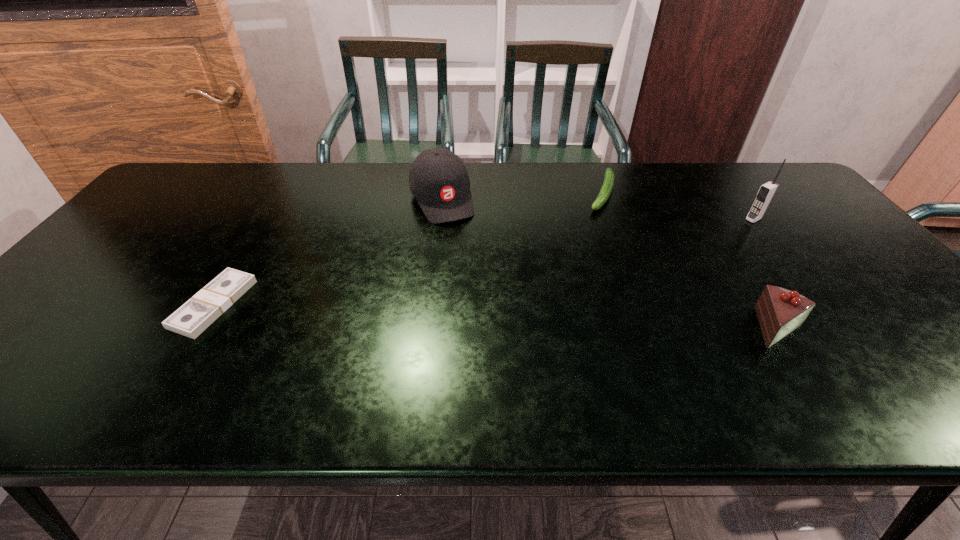
Find the location of a particular element. The height and width of the screenshot is (540, 960). vacant space positioned on the front-facing side of the rightmost object is located at coordinates (663, 267).

Find the location of `zucchini located at the far edge`. zucchini located at the far edge is located at coordinates (606, 189).

The width and height of the screenshot is (960, 540). In order to click on baseball cap present at the far edge in this screenshot , I will do (x=438, y=179).

Where is `dollar located at the near edge`? dollar located at the near edge is located at coordinates (200, 311).

Locate an element on the screen. chocolate cake present at the near edge is located at coordinates (780, 311).

Where is `vacant area at the far edge of the desktop`? The width and height of the screenshot is (960, 540). vacant area at the far edge of the desktop is located at coordinates pyautogui.click(x=474, y=199).

Identify the location of vacant space at the near edge of the desktop. The height and width of the screenshot is (540, 960). (187, 343).

In the image, there is a desktop. Identify the location of vacant region at the left edge. (69, 303).

Where is `vacant space at the right edge`? vacant space at the right edge is located at coordinates (884, 294).

Locate an element on the screen. The width and height of the screenshot is (960, 540). vacant position at the far left corner of the desktop is located at coordinates (210, 184).